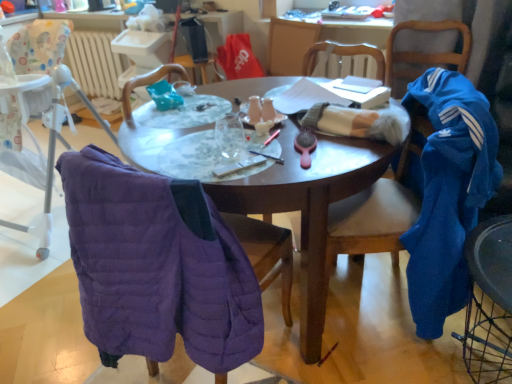
At what (x,y) coordinates should I click in order to perform the action: click on vacant area on the back side of matte black pen at center. Please return your answer as a coordinate pair (x, y). This screenshot has height=384, width=512. Looking at the image, I should click on (263, 136).